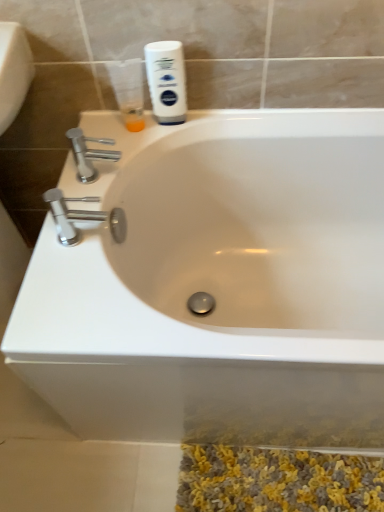
Find the location of a particular element. The image size is (384, 512). free region on the left part of translucent plastic cup at upper left is located at coordinates (98, 136).